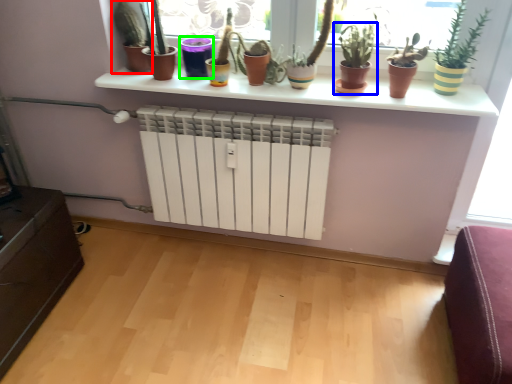
Question: Based on their relative distances, which object is nearer to houseplant (highlighted by a red box)? Choose from houseplant (highlighted by a blue box) and vase (highlighted by a green box).

Choices:
 (A) houseplant
 (B) vase

Answer: (B)